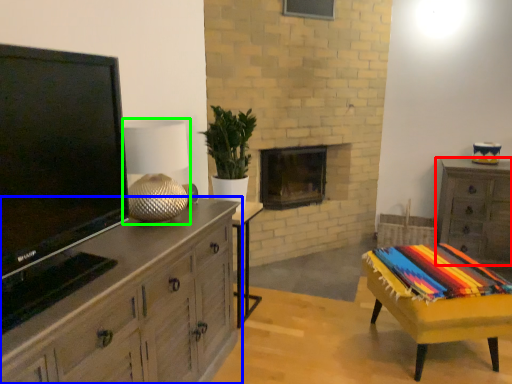
Question: Based on their relative distances, which object is nearer to chest of drawers (highlighted by a red box)? Choose from chest of drawers (highlighted by a blue box) and lamp (highlighted by a green box).

Choices:
 (A) chest of drawers
 (B) lamp

Answer: (A)